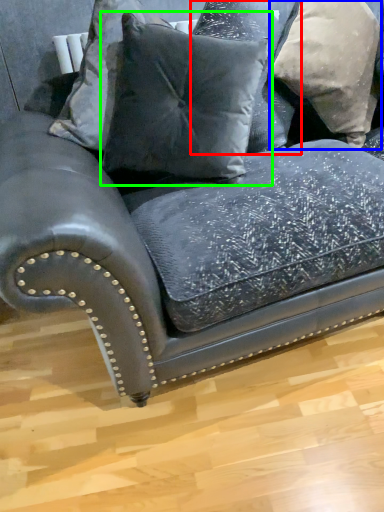
Question: Which is farther away from pillow (highlighted by a red box)? pillow (highlighted by a blue box) or pillow (highlighted by a green box)?

Choices:
 (A) pillow
 (B) pillow

Answer: (B)